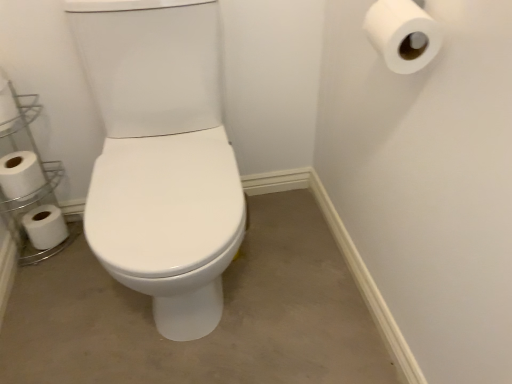
The image size is (512, 384). What do you see at coordinates (216, 328) in the screenshot? I see `white glossy toilet at center` at bounding box center [216, 328].

What is the approximate height of white matte toilet paper at left, which is the 2th toilet paper in right-to-left order?

The height of white matte toilet paper at left, which is the 2th toilet paper in right-to-left order, is 4.15 inches.

The height and width of the screenshot is (384, 512). Describe the element at coordinates (7, 105) in the screenshot. I see `white matte toilet paper at left, which is the 2th toilet paper in right-to-left order` at that location.

What is the approximate width of white matte toilet paper at lower left, marked as the 1th toilet paper in a left-to-right arrangement?

11.59 centimeters.

Locate an element on the screen. Image resolution: width=512 pixels, height=384 pixels. white glossy toilet at center is located at coordinates (216, 328).

In the scene shown: Who is shorter, white matte toilet paper at lower left, marked as the 1th toilet paper in a left-to-right arrangement, or white matte toilet paper at lower left, positioned as the 3th toilet paper in right-to-left order?

With less height is white matte toilet paper at lower left, marked as the 1th toilet paper in a left-to-right arrangement.

How many degrees apart are the facing directions of white matte toilet paper at lower left, which appears as the 1th toilet paper when viewed from the back, and white matte toilet paper at lower left, which ranks as the 2th toilet paper in left-to-right order?

The facing directions of white matte toilet paper at lower left, which appears as the 1th toilet paper when viewed from the back, and white matte toilet paper at lower left, which ranks as the 2th toilet paper in left-to-right order, are 0.00307 degrees apart.

Are white matte toilet paper at lower left, which is counted as the 1th toilet paper, starting from the bottom, and white matte toilet paper at lower left, which ranks as the third toilet paper in top-to-bottom order, located far from each other?

No, white matte toilet paper at lower left, which is counted as the 1th toilet paper, starting from the bottom, is in close proximity to white matte toilet paper at lower left, which ranks as the third toilet paper in top-to-bottom order.

Considering the relative positions of white plastic shelf at left and white matte toilet paper at lower left, marked as the 1th toilet paper in a left-to-right arrangement, in the image provided, is white plastic shelf at left to the right of white matte toilet paper at lower left, marked as the 1th toilet paper in a left-to-right arrangement, from the viewer's perspective?

Correct, you'll find white plastic shelf at left to the right of white matte toilet paper at lower left, marked as the 1th toilet paper in a left-to-right arrangement.

Is white matte toilet paper at lower left, marked as the fourth toilet paper in a right-to-left arrangement, inside white plastic shelf at left?

Yes.

From the image's perspective, which is below, white plastic shelf at left or white matte toilet paper at lower left, which is the 4th toilet paper in front-to-back order?

white matte toilet paper at lower left, which is the 4th toilet paper in front-to-back order.

Is white plastic shelf at left far away from white matte toilet paper at lower left, marked as the 1th toilet paper in a left-to-right arrangement?

white plastic shelf at left is near white matte toilet paper at lower left, marked as the 1th toilet paper in a left-to-right arrangement, not far away.

Considering the relative sizes of white matte toilet paper at lower left, which ranks as the third toilet paper in top-to-bottom order, and white matte toilet paper at lower left, which is the 4th toilet paper in front-to-back order, in the image provided, is white matte toilet paper at lower left, which ranks as the third toilet paper in top-to-bottom order, smaller than white matte toilet paper at lower left, which is the 4th toilet paper in front-to-back order,?

Incorrect, white matte toilet paper at lower left, which ranks as the third toilet paper in top-to-bottom order, is not smaller in size than white matte toilet paper at lower left, which is the 4th toilet paper in front-to-back order.

Is white matte toilet paper at lower left, which ranks as the 2th toilet paper in left-to-right order, far from white matte toilet paper at lower left, which is counted as the 1th toilet paper, starting from the bottom?

No, white matte toilet paper at lower left, which ranks as the 2th toilet paper in left-to-right order, is not far from white matte toilet paper at lower left, which is counted as the 1th toilet paper, starting from the bottom.

Which of these two, white matte toilet paper at lower left, positioned as the second toilet paper in back-to-front order, or white matte toilet paper at lower left, marked as the 1th toilet paper in a left-to-right arrangement, is thinner?

white matte toilet paper at lower left, marked as the 1th toilet paper in a left-to-right arrangement, is thinner.

There is a white matte toilet paper at lower left, marked as the 1th toilet paper in a left-to-right arrangement. Identify the location of the 1st toilet paper above it (from a real-world perspective). This screenshot has height=384, width=512. (20, 174).

Is white matte toilet paper at lower left, which ranks as the 2th toilet paper in left-to-right order, further to the viewer compared to white matte toilet paper at left, which is the 2th toilet paper from top to bottom?

Yes, it is.

Is white matte toilet paper at lower left, which appears as the third toilet paper when viewed from the front, situated inside white matte toilet paper at left, the 3th toilet paper positioned from the bottom, or outside?

white matte toilet paper at lower left, which appears as the third toilet paper when viewed from the front, cannot be found inside white matte toilet paper at left, the 3th toilet paper positioned from the bottom.

Would you say white matte toilet paper at lower left, which ranks as the third toilet paper in top-to-bottom order, is a long distance from white matte toilet paper at left, which is the 2th toilet paper from top to bottom?

No.

Does white matte toilet paper at lower left, positioned as the second toilet paper in back-to-front order, have a smaller size compared to white matte toilet paper at left, marked as the 3th toilet paper in a back-to-front arrangement?

Actually, white matte toilet paper at lower left, positioned as the second toilet paper in back-to-front order, might be larger than white matte toilet paper at left, marked as the 3th toilet paper in a back-to-front arrangement.

Considering the sizes of objects white matte toilet paper at upper right, the 1th toilet paper viewed from the front, and white matte toilet paper at left, which is the 2th toilet paper from top to bottom, in the image provided, who is taller, white matte toilet paper at upper right, the 1th toilet paper viewed from the front, or white matte toilet paper at left, which is the 2th toilet paper from top to bottom,?

With more height is white matte toilet paper at upper right, the 1th toilet paper viewed from the front.

Which is in front, white matte toilet paper at upper right, the first toilet paper from the top, or white matte toilet paper at left, the 3th toilet paper positioned from the bottom?

white matte toilet paper at upper right, the first toilet paper from the top, is closer to the camera.

Is white matte toilet paper at upper right, the first toilet paper from the top, to the right of white matte toilet paper at left, which ranks as the second toilet paper in front-to-back order, from the viewer's perspective?

Indeed, white matte toilet paper at upper right, the first toilet paper from the top, is positioned on the right side of white matte toilet paper at left, which ranks as the second toilet paper in front-to-back order.

Which of these two, white matte toilet paper at upper right, the 4th toilet paper when ordered from left to right, or white matte toilet paper at left, which is the 2th toilet paper from top to bottom, is thinner?

white matte toilet paper at left, which is the 2th toilet paper from top to bottom, is thinner.

Would you say white matte toilet paper at upper right, the 4th toilet paper when ordered from left to right, is a long distance from white matte toilet paper at lower left, which appears as the 1th toilet paper when viewed from the back?

Absolutely, white matte toilet paper at upper right, the 4th toilet paper when ordered from left to right, is distant from white matte toilet paper at lower left, which appears as the 1th toilet paper when viewed from the back.

How different are the orientations of white matte toilet paper at upper right, the first toilet paper from the top, and white matte toilet paper at lower left, the fourth toilet paper viewed from the top, in degrees?

The angular difference between white matte toilet paper at upper right, the first toilet paper from the top, and white matte toilet paper at lower left, the fourth toilet paper viewed from the top, is 89.2 degrees.

In the image, is white matte toilet paper at upper right, which is the 1th toilet paper from right to left, on the left side or the right side of white matte toilet paper at lower left, marked as the fourth toilet paper in a right-to-left arrangement?

In the image, white matte toilet paper at upper right, which is the 1th toilet paper from right to left, appears on the right side of white matte toilet paper at lower left, marked as the fourth toilet paper in a right-to-left arrangement.

Consider the image. Can you confirm if white matte toilet paper at lower left, which is counted as the 1th toilet paper, starting from the bottom, is taller than white matte toilet paper at upper right, which ranks as the fourth toilet paper in bottom-to-top order?

Incorrect, the height of white matte toilet paper at lower left, which is counted as the 1th toilet paper, starting from the bottom, is not larger of that of white matte toilet paper at upper right, which ranks as the fourth toilet paper in bottom-to-top order.

Where is `the 3rd toilet paper to the left of the white matte toilet paper at upper right, the 4th toilet paper when ordered from left to right, starting your count from the anchor`? the 3rd toilet paper to the left of the white matte toilet paper at upper right, the 4th toilet paper when ordered from left to right, starting your count from the anchor is located at coordinates (45, 226).

Is white matte toilet paper at lower left, marked as the fourth toilet paper in a right-to-left arrangement, thinner than white matte toilet paper at upper right, the 1th toilet paper viewed from the front?

Yes.

Considering the relative positions of white matte toilet paper at lower left, which appears as the 1th toilet paper when viewed from the back, and white matte toilet paper at upper right, the first toilet paper from the top, in the image provided, is white matte toilet paper at lower left, which appears as the 1th toilet paper when viewed from the back, to the left or to the right of white matte toilet paper at upper right, the first toilet paper from the top,?

In the image, white matte toilet paper at lower left, which appears as the 1th toilet paper when viewed from the back, appears on the left side of white matte toilet paper at upper right, the first toilet paper from the top.

I want to click on toilet paper below the white matte toilet paper at lower left, which appears as the third toilet paper when viewed from the front (from a real-world perspective), so click(x=45, y=226).

Image resolution: width=512 pixels, height=384 pixels. I want to click on shelf that is on the right side of white matte toilet paper at lower left, which is counted as the 1th toilet paper, starting from the bottom, so click(x=29, y=182).

From the image, which object appears to be nearer to white matte toilet paper at lower left, positioned as the 3th toilet paper in right-to-left order, white plastic shelf at left or white matte toilet paper at left, marked as the 3th toilet paper in a back-to-front arrangement?

white plastic shelf at left.

From the image, which object appears to be farther from white plastic shelf at left, white matte toilet paper at upper right, which is the 1th toilet paper from right to left, or white glossy toilet at center?

white matte toilet paper at upper right, which is the 1th toilet paper from right to left.

Looking at this image, which object lies further to the anchor point white matte toilet paper at lower left, which ranks as the 2th toilet paper in left-to-right order, white glossy toilet at center or white matte toilet paper at upper right, which ranks as the fourth toilet paper in bottom-to-top order?

Among the two, white matte toilet paper at upper right, which ranks as the fourth toilet paper in bottom-to-top order, is located further to white matte toilet paper at lower left, which ranks as the 2th toilet paper in left-to-right order.

Considering their positions, is white matte toilet paper at upper right, the first toilet paper from the top, positioned closer to white glossy toilet at center than white matte toilet paper at lower left, which appears as the 1th toilet paper when viewed from the back?

Among the two, white matte toilet paper at lower left, which appears as the 1th toilet paper when viewed from the back, is located nearer to white glossy toilet at center.

From the image, which object appears to be nearer to white matte toilet paper at upper right, arranged as the fourth toilet paper when viewed from the back, white matte toilet paper at lower left, which appears as the 1th toilet paper when viewed from the back, or white glossy toilet at center?

white glossy toilet at center is closer to white matte toilet paper at upper right, arranged as the fourth toilet paper when viewed from the back.

In the scene shown: From the image, which object appears to be farther from white plastic shelf at left, white matte toilet paper at lower left, which is counted as the 1th toilet paper, starting from the bottom, or white glossy toilet at center?

white glossy toilet at center.

Based on their spatial positions, is white plastic shelf at left or white matte toilet paper at upper right, which is the 1th toilet paper from right to left, further from white matte toilet paper at left, the 3th toilet paper positioned from the bottom?

white matte toilet paper at upper right, which is the 1th toilet paper from right to left, is positioned further to the anchor white matte toilet paper at left, the 3th toilet paper positioned from the bottom.

Estimate the real-world distances between objects in this image. Which object is closer to white glossy toilet at center, white matte toilet paper at lower left, marked as the fourth toilet paper in a right-to-left arrangement, or white matte toilet paper at upper right, the 1th toilet paper viewed from the front?

Among the two, white matte toilet paper at lower left, marked as the fourth toilet paper in a right-to-left arrangement, is located nearer to white glossy toilet at center.

Where is `toilet paper between white matte toilet paper at left, which is the 2th toilet paper from top to bottom, and white plastic shelf at left, in the vertical direction`? toilet paper between white matte toilet paper at left, which is the 2th toilet paper from top to bottom, and white plastic shelf at left, in the vertical direction is located at coordinates pos(20,174).

You are a GUI agent. You are given a task and a screenshot of the screen. Output one action in this format:
    pyautogui.click(x=<x>, y=<y>)
    Task: Click on the shelf between white matte toilet paper at left, which ranks as the second toilet paper in front-to-back order, and white matte toilet paper at lower left, which is the 4th toilet paper in front-to-back order, along the z-axis
    Image resolution: width=512 pixels, height=384 pixels.
    Given the screenshot: What is the action you would take?
    pyautogui.click(x=29, y=182)

Where is `concrete between white matte toilet paper at lower left, which ranks as the 2th toilet paper in left-to-right order, and white matte toilet paper at upper right, which is the 1th toilet paper from right to left`? The width and height of the screenshot is (512, 384). concrete between white matte toilet paper at lower left, which ranks as the 2th toilet paper in left-to-right order, and white matte toilet paper at upper right, which is the 1th toilet paper from right to left is located at coordinates (216, 328).

You are a GUI agent. You are given a task and a screenshot of the screen. Output one action in this format:
    pyautogui.click(x=<x>, y=<y>)
    Task: Click on the concrete between white matte toilet paper at lower left, marked as the 1th toilet paper in a left-to-right arrangement, and white matte toilet paper at upper right, which ranks as the fourth toilet paper in bottom-to-top order, from left to right
    The height and width of the screenshot is (384, 512).
    Given the screenshot: What is the action you would take?
    pyautogui.click(x=216, y=328)